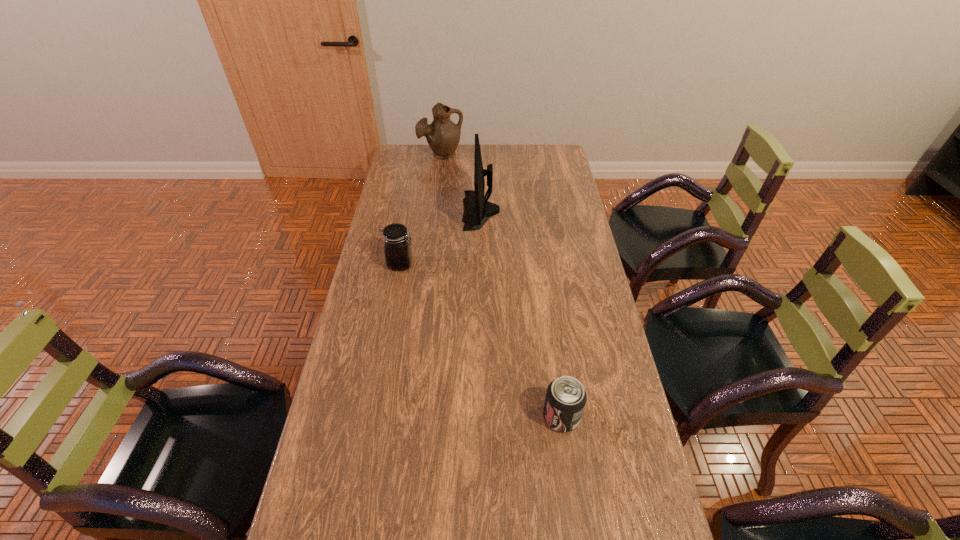
At what (x,y) coordinates should I click in order to perform the action: click on free space at the far right corner of the desktop. Please return your answer as a coordinate pair (x, y). This screenshot has width=960, height=540. Looking at the image, I should click on (560, 165).

Find the location of `unoccupied position between the third farthest object and the second object from right to left`. unoccupied position between the third farthest object and the second object from right to left is located at coordinates (441, 237).

Locate an element on the screen. vacant point located between the third nearest object and the third farthest object is located at coordinates (441, 237).

Find the location of a particular element. This screenshot has width=960, height=540. vacant space that's between the second nearest object and the shortest object is located at coordinates (481, 340).

The height and width of the screenshot is (540, 960). What are the coordinates of `empty space that is in between the monitor and the second nearest object` in the screenshot? It's located at (441, 237).

Where is `free spot between the farthest object and the monitor`? free spot between the farthest object and the monitor is located at coordinates (461, 182).

Locate an element on the screen. free space between the pitcher and the third object from left to right is located at coordinates (461, 182).

Where is `free space between the monitor and the jar`? free space between the monitor and the jar is located at coordinates (441, 237).

I want to click on free spot between the soda can and the monitor, so click(x=521, y=313).

The height and width of the screenshot is (540, 960). Find the location of `free space between the third object from left to right and the pitcher`. free space between the third object from left to right and the pitcher is located at coordinates (461, 182).